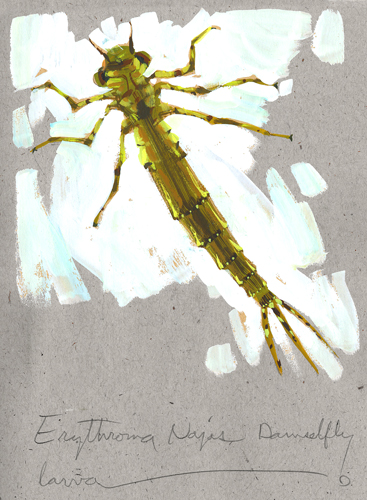
Locate an element on the screen. white paint is located at coordinates (151, 239).